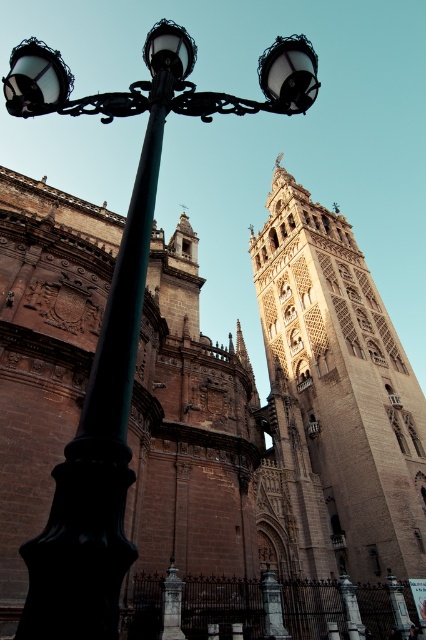
You are an architect analyzing the spatial relationship between the light brown stone tower at upper right and the matte black streetlamp at upper left. Which structure is shorter?

The light brown stone tower at upper right is shorter than the matte black streetlamp at upper left according to the description.

You are standing in the square in front of the cathedral and notice two structures nearby. The light brown stone tower at upper right and the black wrought iron street light at left. Which one appears taller from your vantage point?

The light brown stone tower at upper right has a lesser height compared to the black wrought iron street light at left, so the black wrought iron street light at left appears taller from your vantage point.